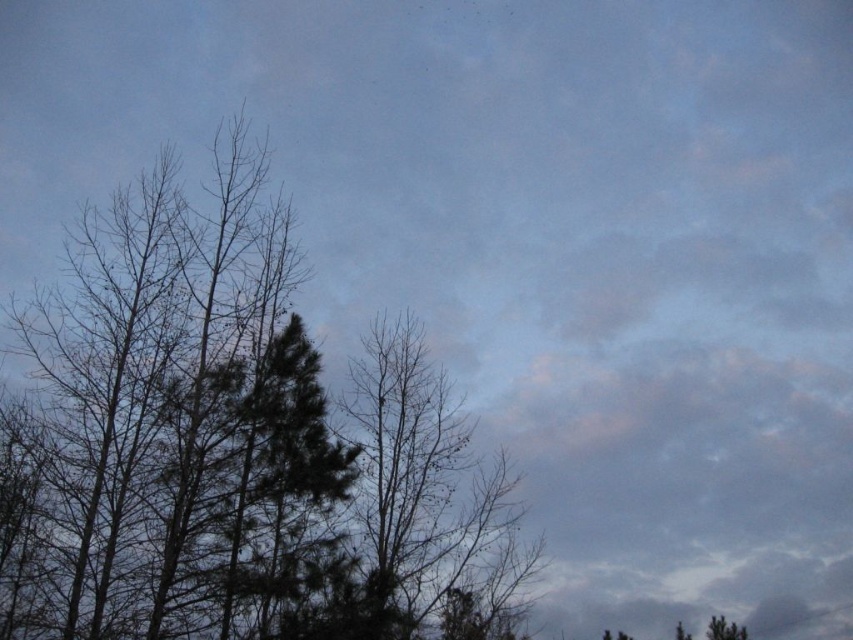
Question: Which object appears farthest from the camera in this image?

Choices:
 (A) dark green leafy tree at left
 (B) bare branches at center

Answer: (B)

Question: Is the position of dark green leafy tree at left less distant than that of bare branches at center?

Choices:
 (A) yes
 (B) no

Answer: (A)

Question: Is dark green leafy tree at left to the right of bare branches at center from the viewer's perspective?

Choices:
 (A) yes
 (B) no

Answer: (B)

Question: Does dark green leafy tree at left appear under bare branches at center?

Choices:
 (A) yes
 (B) no

Answer: (B)